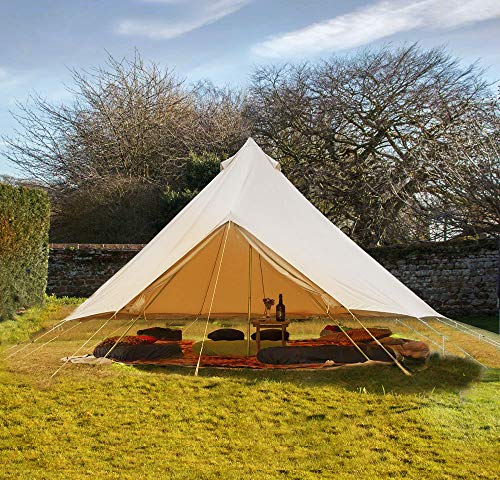
Image resolution: width=500 pixels, height=480 pixels. In order to click on vase with flowers inside of tent in this screenshot , I will do `click(270, 301)`.